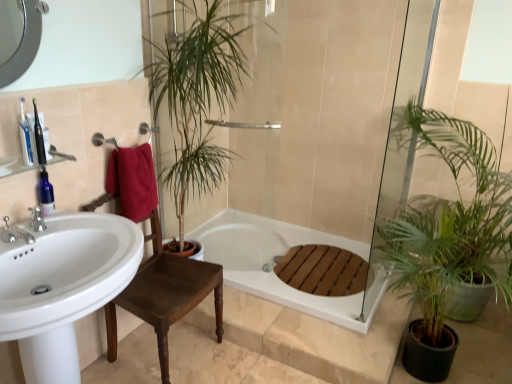
Where is `vacant space behind brushed metal faucet at left, which appears as the 1th tap when viewed from the front`? vacant space behind brushed metal faucet at left, which appears as the 1th tap when viewed from the front is located at coordinates (57, 232).